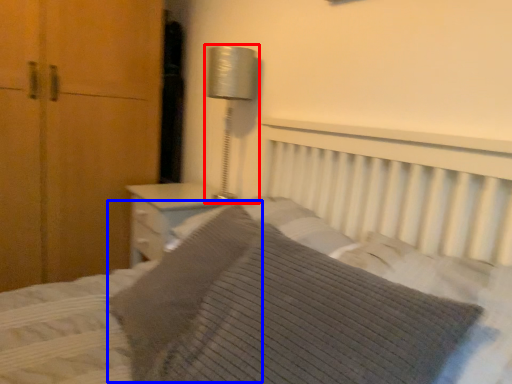
Question: Among these objects, which one is farthest to the camera, bedside lamp (highlighted by a red box) or pillow (highlighted by a blue box)?

Choices:
 (A) bedside lamp
 (B) pillow

Answer: (A)